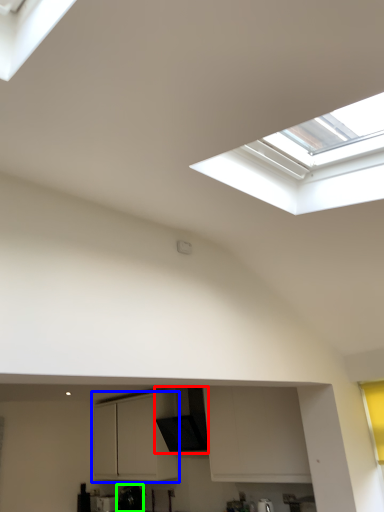
Question: Which is farther away from exhaust hood (highlighted by a red box)? cabinetry (highlighted by a blue box) or appliance (highlighted by a green box)?

Choices:
 (A) cabinetry
 (B) appliance

Answer: (B)